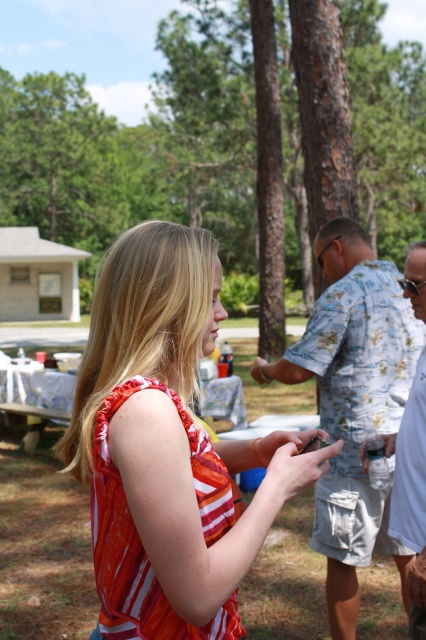
Can you confirm if orange striped tank top at center is shorter than white cotton shirt at right?

Indeed, orange striped tank top at center has a lesser height compared to white cotton shirt at right.

Is orange striped tank top at center bigger than white cotton shirt at right?

Indeed, orange striped tank top at center has a larger size compared to white cotton shirt at right.

Is point (161, 237) farther from viewer compared to point (411, 506)?

No, (161, 237) is in front of (411, 506).

This screenshot has height=640, width=426. What are the coordinates of `orange striped tank top at center` in the screenshot? It's located at (167, 448).

Who is positioned more to the right, floral shirt at center or white cotton shirt at right?

white cotton shirt at right

Image resolution: width=426 pixels, height=640 pixels. Describe the element at coordinates (351, 401) in the screenshot. I see `floral shirt at center` at that location.

This screenshot has height=640, width=426. What are the coordinates of `floral shirt at center` in the screenshot? It's located at (351, 401).

Locate an element on the screen. The height and width of the screenshot is (640, 426). floral shirt at center is located at coordinates (351, 401).

Does orange striped tank top at center appear on the right side of floral shirt at center?

No, orange striped tank top at center is not to the right of floral shirt at center.

Where is `orange striped tank top at center`? The image size is (426, 640). orange striped tank top at center is located at coordinates (167, 448).